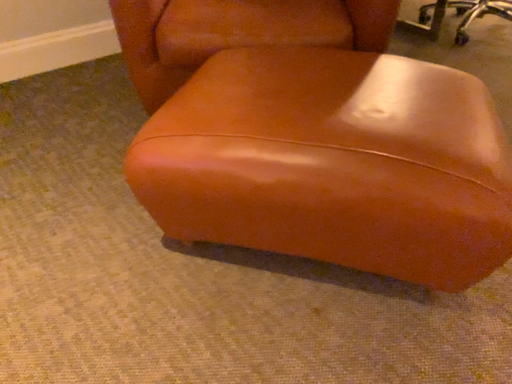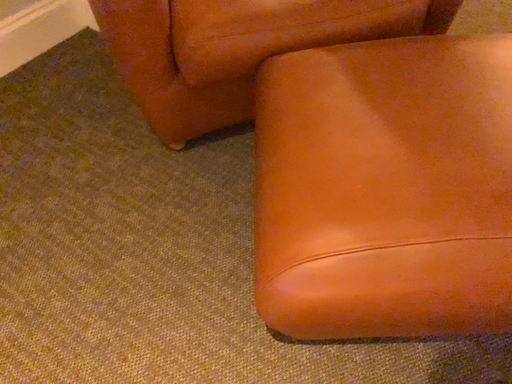
Question: How did the camera likely rotate when shooting the video?

Choices:
 (A) rotated downward
 (B) rotated upward

Answer: (A)